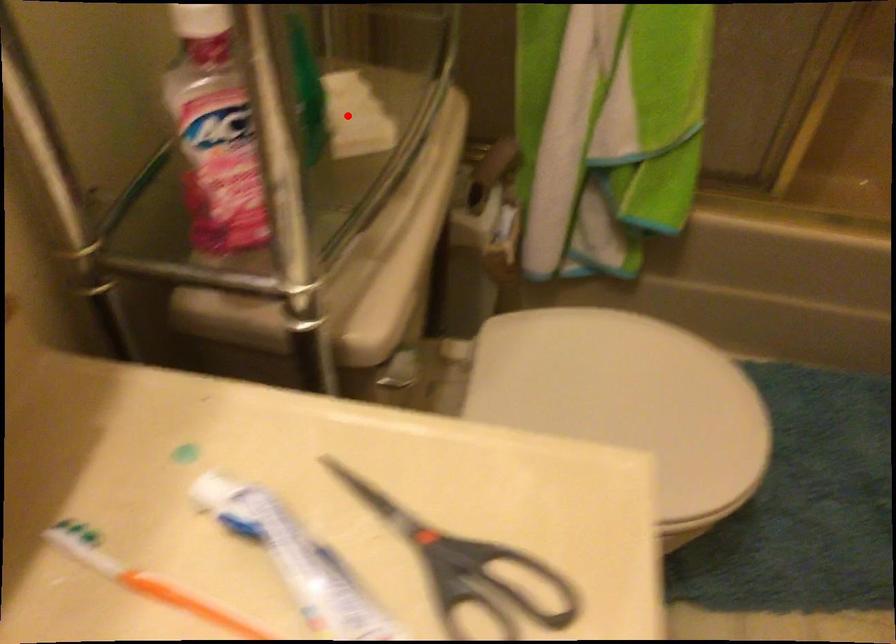
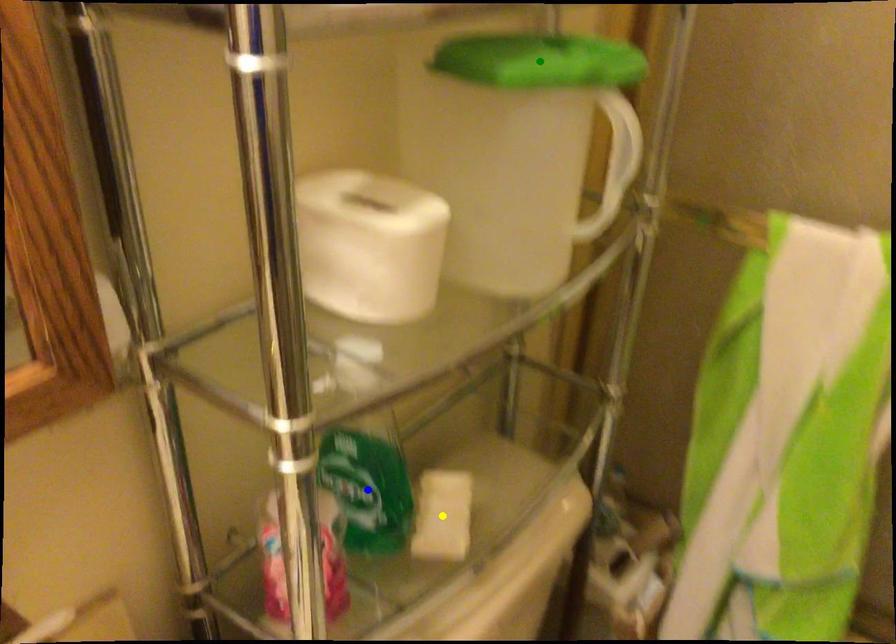
Question: I am providing you with two images of the same scene from different viewpoints. A red point is marked on the first image. You are given multiple points on the second image. Which spot in image 2 lines up with the point in image 1?

Choices:
 (A) green point
 (B) yellow point
 (C) blue point

Answer: (B)